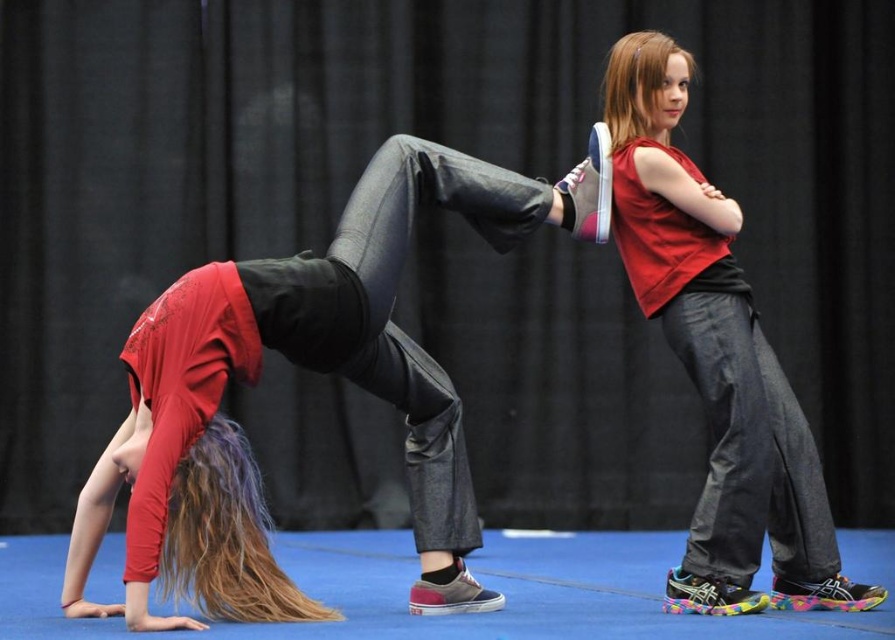
Which of these two, matte black leggings at center or matte red tank top at center, stands shorter?

matte black leggings at center

The height and width of the screenshot is (640, 895). What do you see at coordinates (403, 332) in the screenshot?
I see `matte black leggings at center` at bounding box center [403, 332].

Find the location of a particular element. The height and width of the screenshot is (640, 895). matte black leggings at center is located at coordinates (403, 332).